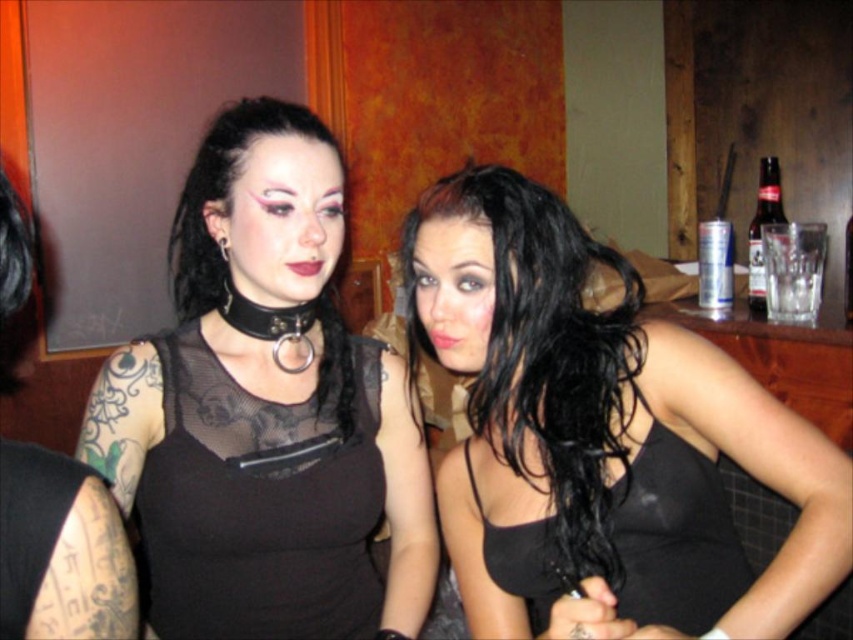
Does matte black top at center come in front of black satin dress at center?

No, matte black top at center is behind black satin dress at center.

Is matte black top at center below black satin dress at center?

No, matte black top at center is not below black satin dress at center.

Identify the location of matte black top at center. This screenshot has width=853, height=640. (265, 408).

Based on the photo, can you confirm if black satin dress at center is shorter than black leather choker at upper center?

No.

Can you confirm if black satin dress at center is wider than black leather choker at upper center?

Indeed, black satin dress at center has a greater width compared to black leather choker at upper center.

Between point (715, 548) and point (219, 237), which one is positioned behind?

Point (219, 237)

You are a GUI agent. You are given a task and a screenshot of the screen. Output one action in this format:
    pyautogui.click(x=<x>, y=<y>)
    Task: Click on the black satin dress at center
    
    Given the screenshot: What is the action you would take?
    pyautogui.click(x=672, y=538)

Does matte black top at center have a greater height compared to black leather choker at upper center?

Indeed, matte black top at center has a greater height compared to black leather choker at upper center.

Does point (235, 221) come behind point (222, 253)?

That is False.

Who is more forward, (222, 561) or (219, 241)?

Point (222, 561) is more forward.

Find the location of `matte black top at center`. matte black top at center is located at coordinates (265, 408).